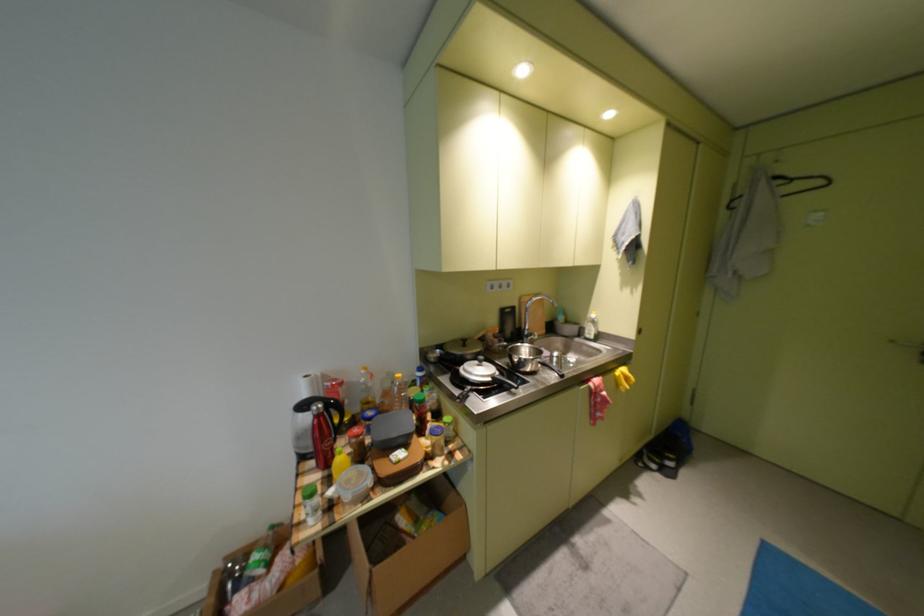
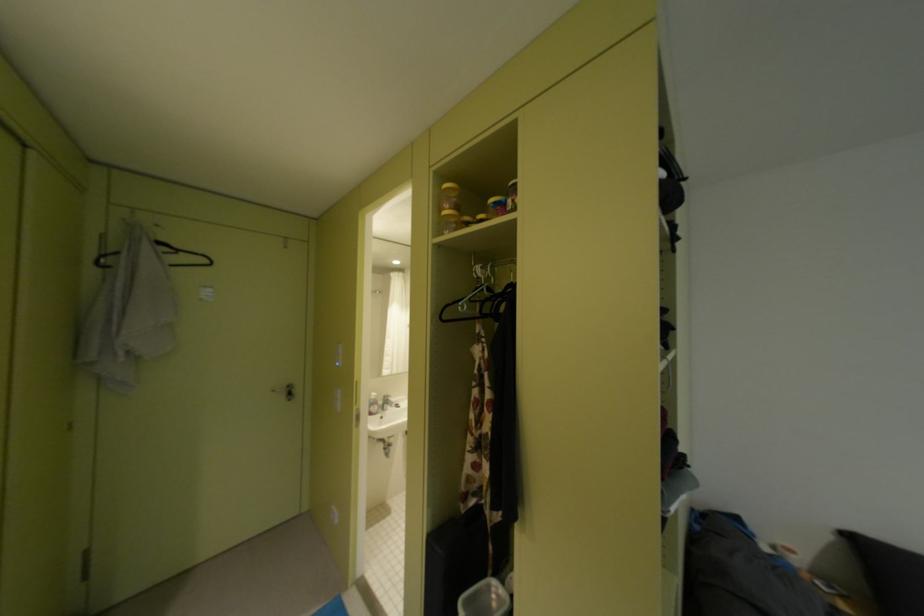
Where in the second image is the point corresponding to pixel 789 184 from the first image?

(175, 249)